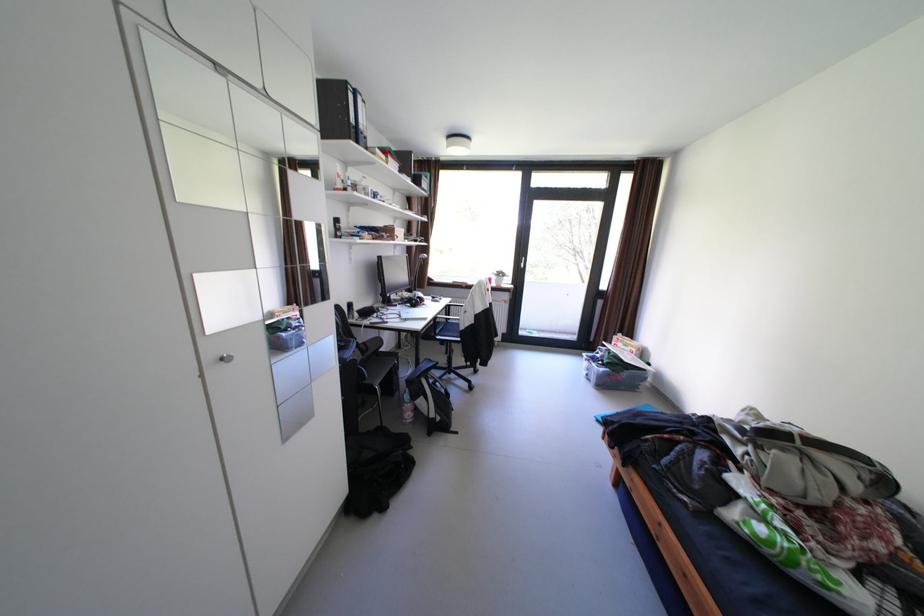
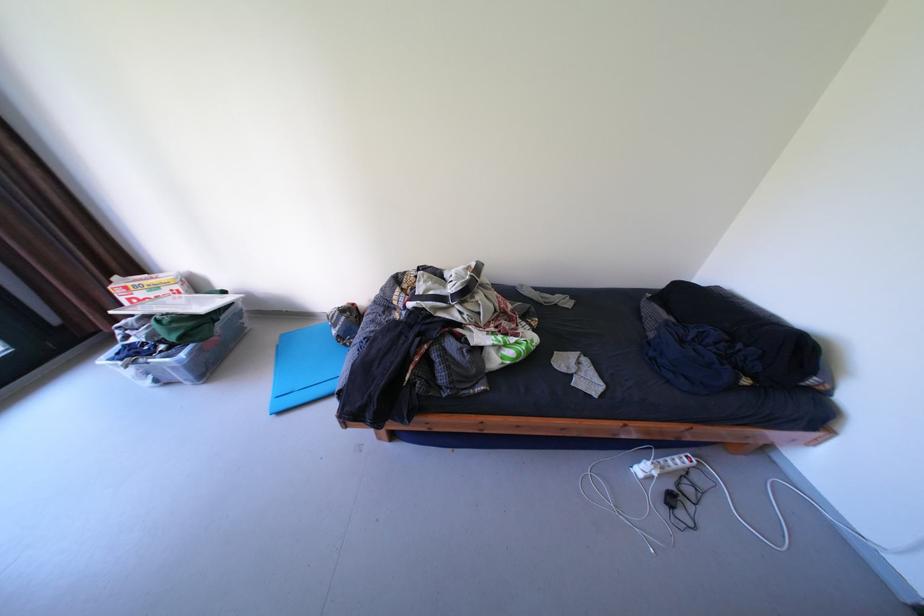
In the second image, find the point that corresponds to pixel 612 370 in the first image.

(193, 355)